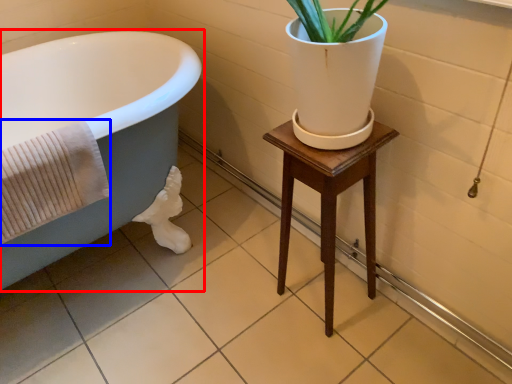
Question: Among these objects, which one is nearest to the camera, bathtub (highlighted by a red box) or bath towel (highlighted by a blue box)?

Choices:
 (A) bathtub
 (B) bath towel

Answer: (A)